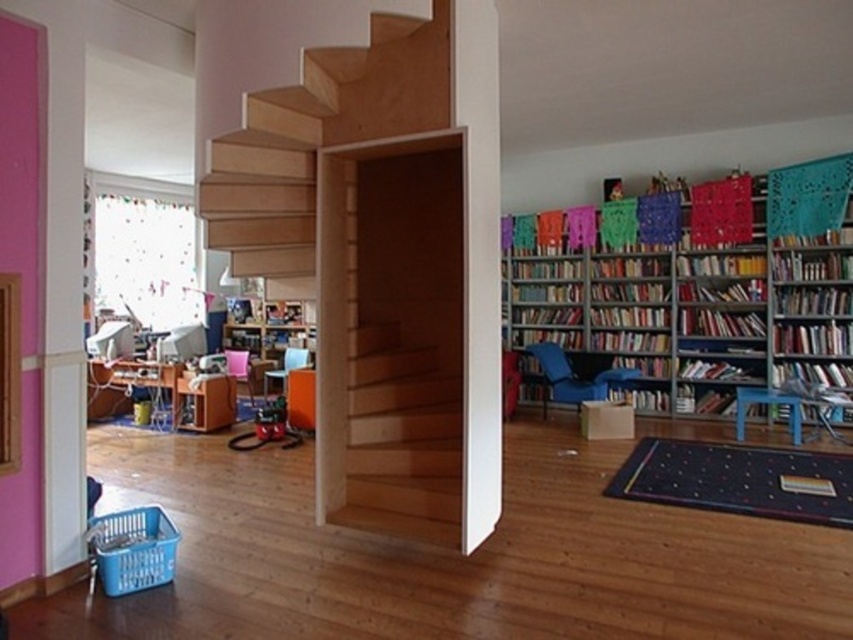
You are standing at the bottom of the wooden stairs at center and want to reach the hardcover book at upper right. Which direction should you move?

To reach the hardcover book at upper right, you should move upward along the wooden stairs at center since it is located above the book.

You are an interior designer planning to place a new piece of furniture in the room. You have a small, compact desk that needs to fit between the wooden stairs at center and the hardcover book at upper right. Considering their sizes, can the desk be placed there?

The wooden stairs at center is larger in size than the hardcover book at upper right. Since the desk is small and compact, there should be enough space between them to place it.

You are arranging books in a room with a floating staircase. You need to place a new book on the shelf. The metallic silver bookcase at right and the hardcover book at upper right are both in your view. Which object is closer to the staircase?

The metallic silver bookcase at right is to the left of the hardcover book at upper right, so the metallic silver bookcase at right is closer to the staircase since it is positioned to the left of the hardcover book at upper right.